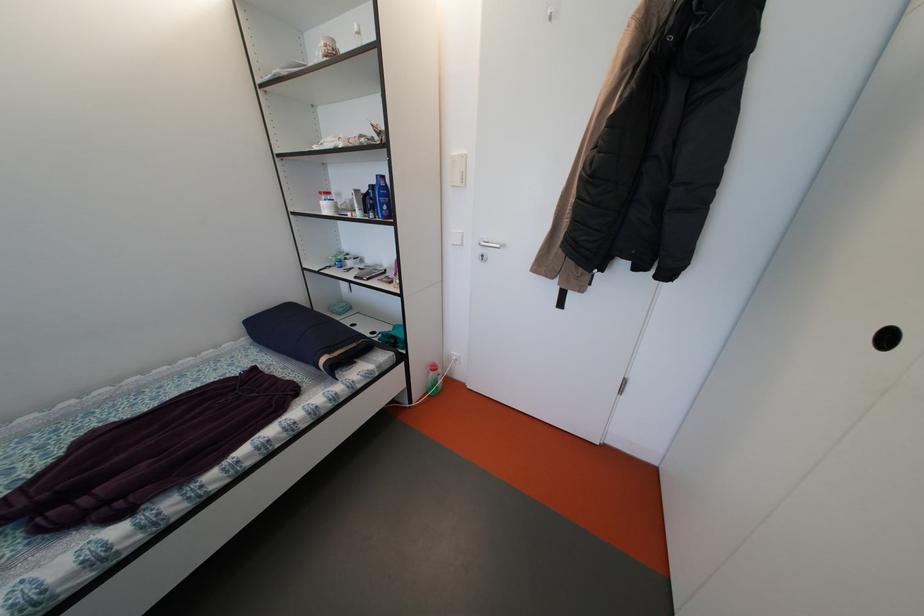
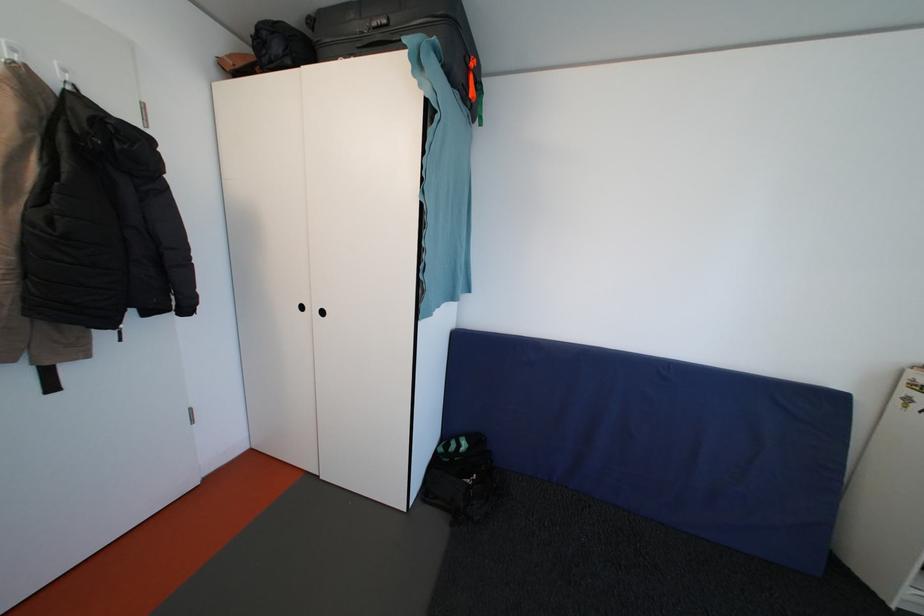
The images are taken continuously from a first-person perspective. In which direction is your viewpoint rotating?

The rotation direction of the camera is right-down.